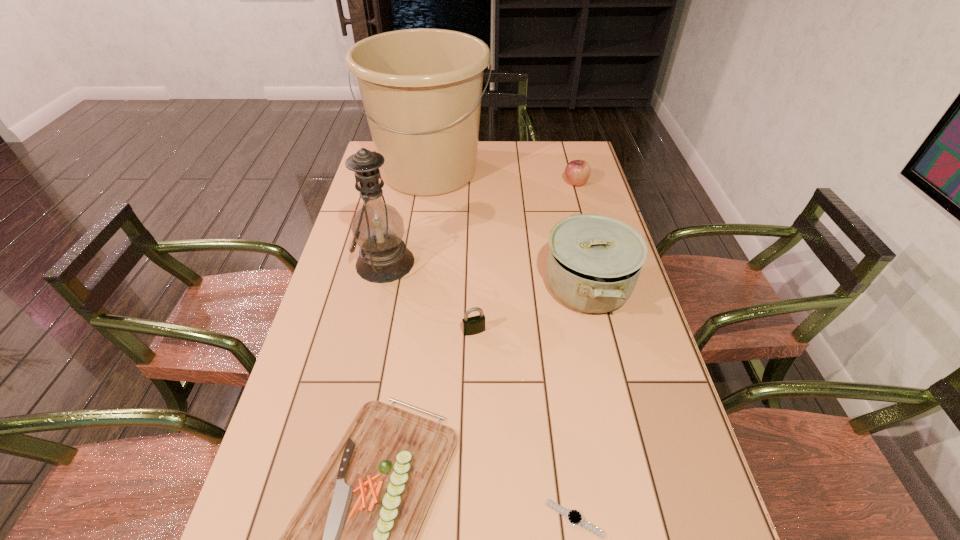
At what (x,y) coordinates should I click in order to perform the action: click on vacant space located on the left of the fifth tallest object. Please return your answer as a coordinate pair (x, y). The height and width of the screenshot is (540, 960). Looking at the image, I should click on (314, 331).

Locate an element on the screen. The image size is (960, 540). vacant point located 0.110m on the right of the watch is located at coordinates (660, 518).

I want to click on object at the far edge, so click(421, 89).

You are a GUI agent. You are given a task and a screenshot of the screen. Output one action in this format:
    pyautogui.click(x=<x>, y=<y>)
    Task: Click on the bucket that is at the left edge
    The width and height of the screenshot is (960, 540).
    Given the screenshot: What is the action you would take?
    pyautogui.click(x=421, y=89)

Where is `oil lamp that is at the left edge`? oil lamp that is at the left edge is located at coordinates (377, 227).

This screenshot has width=960, height=540. In order to click on saucepan situated at the right edge in this screenshot , I will do `click(594, 261)`.

Locate an element on the screen. The image size is (960, 540). apple present at the right edge is located at coordinates (577, 172).

Identify the location of object present at the far left corner. (421, 89).

Locate an element on the screen. Image resolution: width=960 pixels, height=540 pixels. free region at the far edge is located at coordinates (534, 159).

In the image, there is a desktop. Find the location of `free space at the left edge`. free space at the left edge is located at coordinates (386, 187).